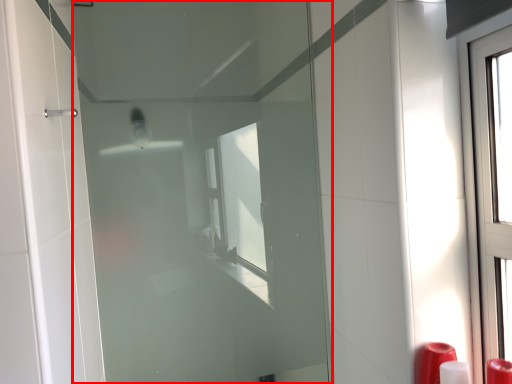
Question: From the image's perspective, what is the correct spatial relationship of door (annotated by the red box) in relation to soap dispenser?

Choices:
 (A) below
 (B) above

Answer: (B)